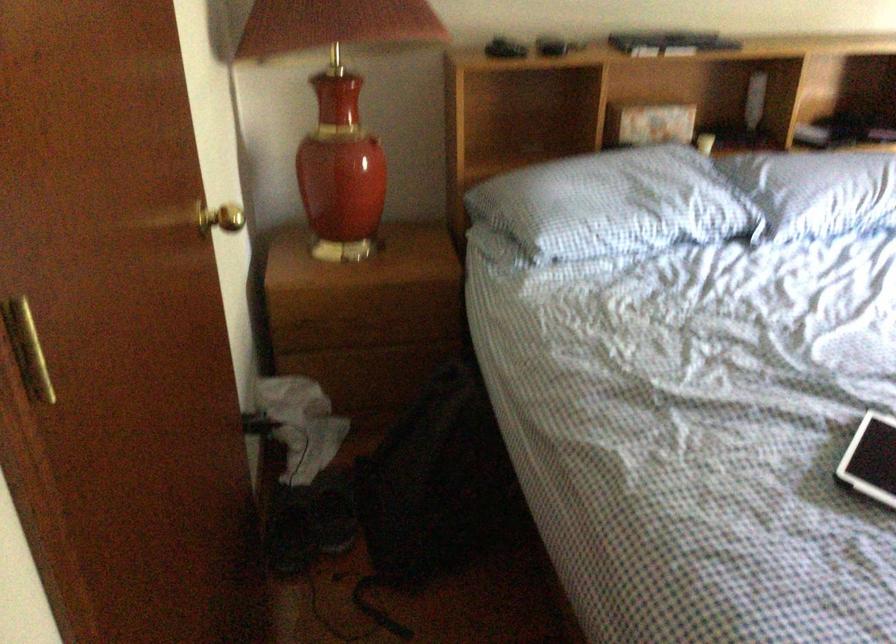
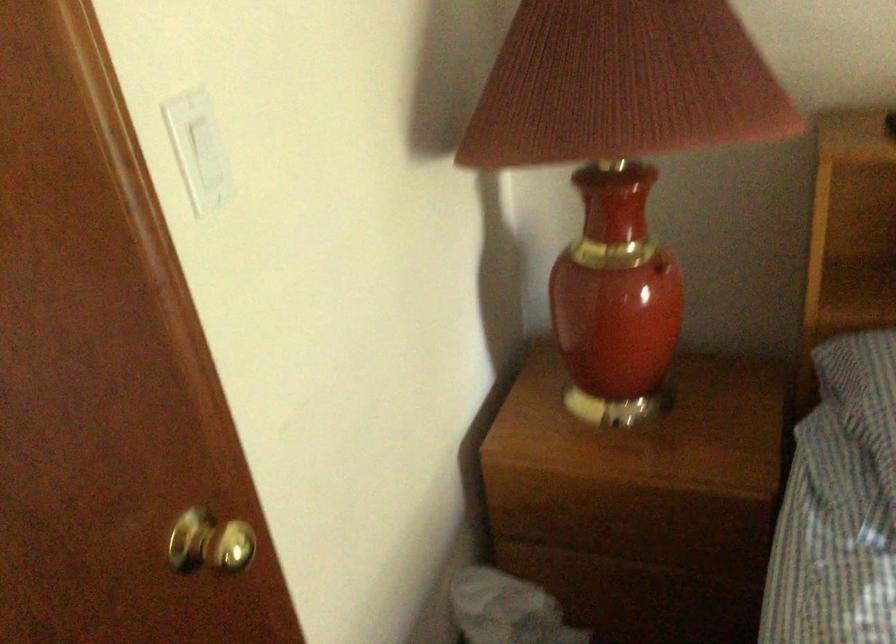
Question: How did the camera likely rotate?

Choices:
 (A) Left
 (B) Right
 (C) Up
 (D) Down

Answer: (A)